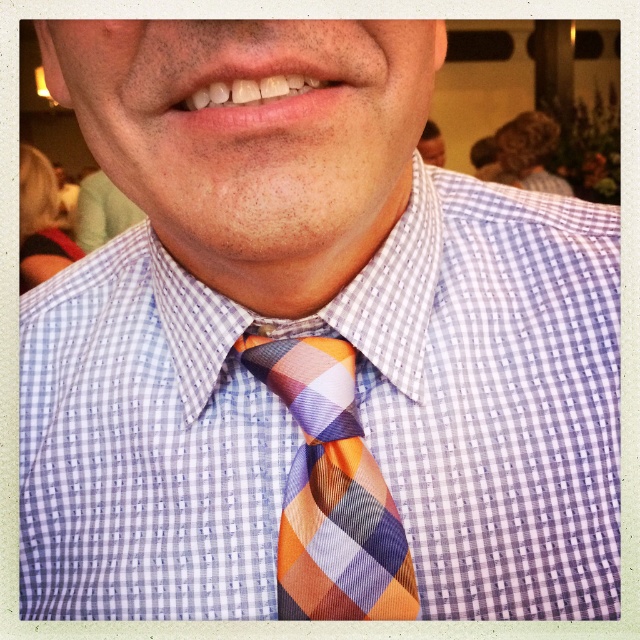
From the picture: Is checkered fabric shirt at center bigger than plaid silk tie at center?

Indeed, checkered fabric shirt at center has a larger size compared to plaid silk tie at center.

Does checkered fabric shirt at center appear on the right side of plaid silk tie at center?

No, checkered fabric shirt at center is not to the right of plaid silk tie at center.

What do you see at coordinates (356, 413) in the screenshot? I see `checkered fabric shirt at center` at bounding box center [356, 413].

Where is `checkered fabric shirt at center`? This screenshot has height=640, width=640. checkered fabric shirt at center is located at coordinates (356, 413).